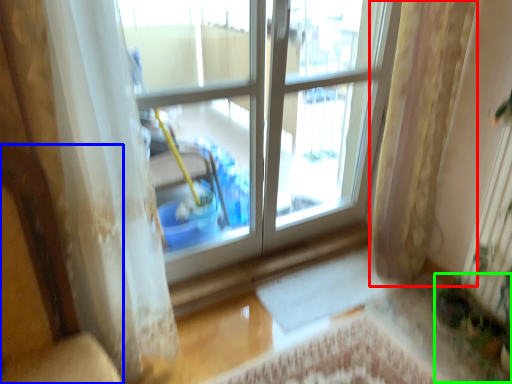
Question: Which object is the farthest from curtain (highlighted by a red box)? Choose among these: armchair (highlighted by a blue box) or plant (highlighted by a green box).

Choices:
 (A) armchair
 (B) plant

Answer: (A)